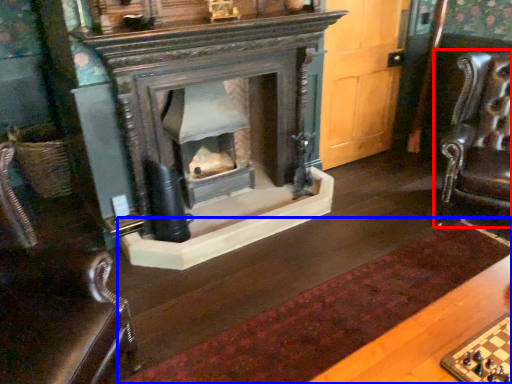
Question: Which object appears farthest to the camera in this image, swivel chair (highlighted by a red box) or mat (highlighted by a blue box)?

Choices:
 (A) swivel chair
 (B) mat

Answer: (A)